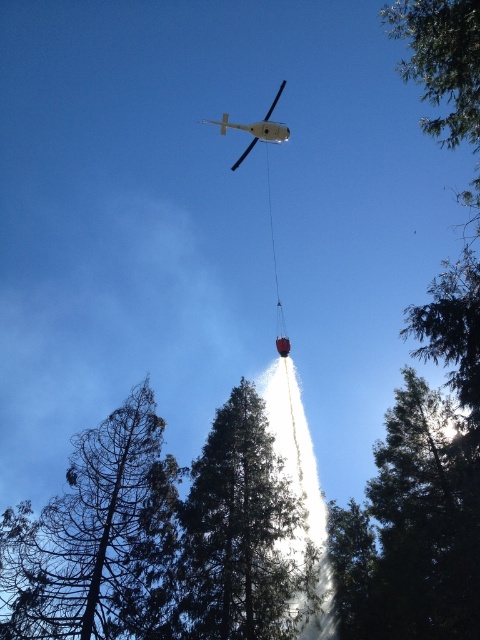
Question: Among these objects, which one is nearest to the camera?

Choices:
 (A) green textured tree at center
 (B) metallic silver helicopter at upper center
 (C) dark brown bark tree at lower left

Answer: (A)

Question: Is dark brown bark tree at lower left wider than metallic silver helicopter at upper center?

Choices:
 (A) yes
 (B) no

Answer: (A)

Question: Is dark brown bark tree at lower left closer to the viewer compared to metallic silver helicopter at upper center?

Choices:
 (A) no
 (B) yes

Answer: (B)

Question: Which point is farther to the camera?

Choices:
 (A) green textured tree at center
 (B) dark brown bark tree at lower left
 (C) metallic silver helicopter at upper center

Answer: (C)

Question: Which of the following is the farthest from the observer?

Choices:
 (A) green textured tree at center
 (B) dark brown bark tree at lower left

Answer: (B)

Question: From the image, what is the correct spatial relationship of dark brown bark tree at lower left in relation to green textured tree at center?

Choices:
 (A) right
 (B) left

Answer: (B)